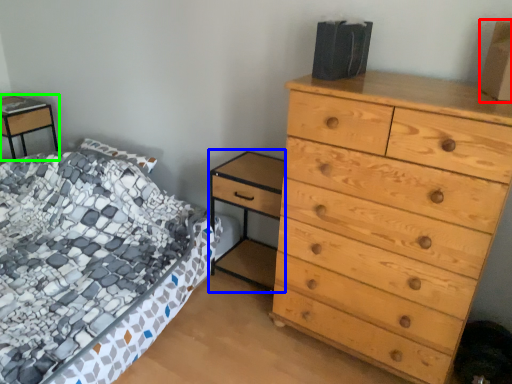
Question: Which object is positioned closest to cardboard box (highlighted by a red box)? Select from nightstand (highlighted by a blue box) and nightstand (highlighted by a green box).

Choices:
 (A) nightstand
 (B) nightstand

Answer: (A)